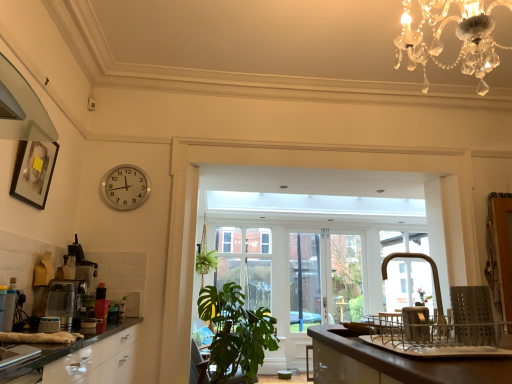
This screenshot has width=512, height=384. I want to click on free space in front of satin silver dishwasher at lower right, marked as the first appliance in a right-to-left arrangement, so click(x=429, y=346).